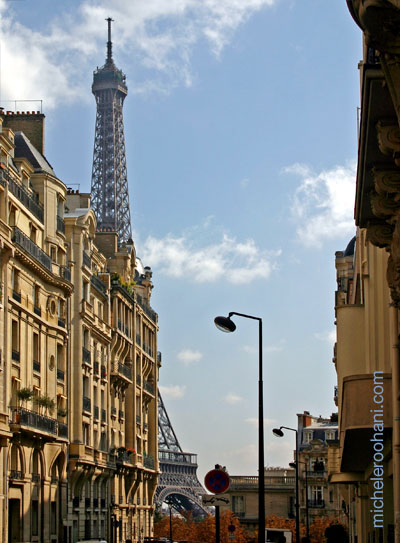
What are the coordinates of `archways` in the screenshot? It's located at (17, 446), (34, 452), (59, 452).